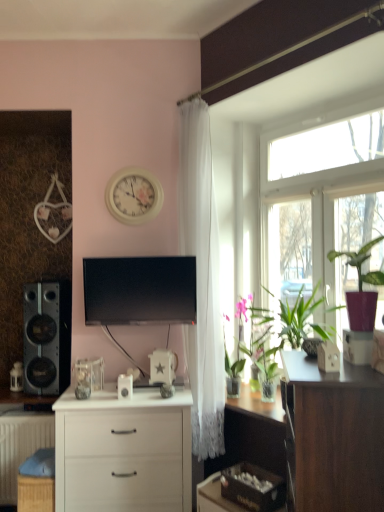
Measure the distance between white sheer curtain at upper center and camera.

white sheer curtain at upper center is 8.81 feet away from camera.

Describe the element at coordinates (47, 337) in the screenshot. This screenshot has height=512, width=384. I see `matte black speaker at left` at that location.

Find the location of `transparent glass window at upper right`. transparent glass window at upper right is located at coordinates (322, 206).

What are the coordinates of `brown wooden desk at lower center` in the screenshot? It's located at (214, 497).

Locate an element on the screen. Image resolution: width=384 pixels, height=512 pixels. white sheer curtain at upper center is located at coordinates (202, 280).

The width and height of the screenshot is (384, 512). I want to click on chest of drawers lying on the left of white sheer curtain at upper center, so click(123, 452).

Considering the sizes of objects white matte chest of drawers at center and white sheer curtain at upper center in the image provided, who is smaller, white matte chest of drawers at center or white sheer curtain at upper center?

white sheer curtain at upper center.

From a real-world perspective, which is physically above, white matte chest of drawers at center or white sheer curtain at upper center?

white sheer curtain at upper center is physically above.

Which is correct: white matte chest of drawers at center is inside white sheer curtain at upper center, or outside of it?

white matte chest of drawers at center lies outside white sheer curtain at upper center.

Is transparent glass window at upper right wider or thinner than brown wooden desk at lower center?

In the image, transparent glass window at upper right appears to be more narrow than brown wooden desk at lower center.

Would you say brown wooden desk at lower center is part of transparent glass window at upper right's contents?

No, brown wooden desk at lower center is not surrounded by transparent glass window at upper right.

From the image's perspective, which is above, transparent glass window at upper right or brown wooden desk at lower center?

transparent glass window at upper right, from the image's perspective.

Is point (117, 323) behind point (31, 488)?

Yes, it is.

Between black glossy tv at center and woven brown picnic basket at lower left, which one has larger size?

With larger size is black glossy tv at center.

Is black glossy tv at center aimed at woven brown picnic basket at lower left?

No, black glossy tv at center is not oriented towards woven brown picnic basket at lower left.

Does transparent glass window at upper right have a lesser width compared to matte black speaker at left?

Yes, transparent glass window at upper right is thinner than matte black speaker at left.

From their relative heights in the image, would you say transparent glass window at upper right is taller or shorter than matte black speaker at left?

In the image, transparent glass window at upper right appears to be taller than matte black speaker at left.

In terms of size, does transparent glass window at upper right appear bigger or smaller than matte black speaker at left?

Considering their sizes, transparent glass window at upper right takes up more space than matte black speaker at left.

Is matte black speaker at left a part of transparent glass window at upper right?

That's incorrect, matte black speaker at left is not inside transparent glass window at upper right.

Is white sheer curtain at upper center positioned far away from woven brown picnic basket at lower left?

That's right, there is a large distance between white sheer curtain at upper center and woven brown picnic basket at lower left.

Could you tell me if white sheer curtain at upper center is facing woven brown picnic basket at lower left?

No, white sheer curtain at upper center is not turned towards woven brown picnic basket at lower left.

Is woven brown picnic basket at lower left a part of white sheer curtain at upper center?

No.

Who is more distant, matte black speaker at left or dark wood cabinet at right?

matte black speaker at left is behind.

Which is more to the right, matte black speaker at left or dark wood cabinet at right?

From the viewer's perspective, dark wood cabinet at right appears more on the right side.

How far apart are matte black speaker at left and dark wood cabinet at right?

A distance of 6.20 feet exists between matte black speaker at left and dark wood cabinet at right.

From a real-world perspective, is matte black speaker at left over dark wood cabinet at right?

Yes, from a real-world perspective, matte black speaker at left is over dark wood cabinet at right

From a real-world perspective, between dark wood cabinet at right and matte black speaker at left, who is vertically higher?

matte black speaker at left is physically above.

Is dark wood cabinet at right situated inside matte black speaker at left or outside?

dark wood cabinet at right exists outside the volume of matte black speaker at left.

Considering the relative sizes of dark wood cabinet at right and matte black speaker at left in the image provided, is dark wood cabinet at right wider than matte black speaker at left?

Yes, dark wood cabinet at right is wider than matte black speaker at left.

Locate an element on the screen. The image size is (384, 512). curtain located above the white matte chest of drawers at center (from a real-world perspective) is located at coordinates (202, 280).

This screenshot has height=512, width=384. I want to click on window on the right of brown wooden desk at lower center, so click(x=322, y=206).

Consider the image. When comparing their distances from white sheer curtain at upper center, does brown wooden desk at lower center or woven brown picnic basket at lower left seem further?

woven brown picnic basket at lower left.

Considering their positions, is translucent glass vase at right, which ranks as the first plant in back-to-front order, positioned closer to brown wooden desk at lower center than woven brown picnic basket at lower left?

Based on the image, translucent glass vase at right, which ranks as the first plant in back-to-front order, appears to be nearer to brown wooden desk at lower center.

Considering their positions, is dark wood cabinet at right positioned closer to matte purple pot at right than white matte radiator at lower left?

Among the two, dark wood cabinet at right is located nearer to matte purple pot at right.

From the image, which object appears to be nearer to white sheer curtain at upper center, white matte radiator at lower left or white matte chest of drawers at center?

white matte chest of drawers at center lies closer to white sheer curtain at upper center than the other object.

Based on their spatial positions, is matte black speaker at left or white glossy clock at upper center closer to white matte radiator at lower left?

The object closer to white matte radiator at lower left is matte black speaker at left.

Based on their spatial positions, is white sheer curtain at upper center or white matte radiator at lower left closer to white glossy clock at upper center?

Based on the image, white sheer curtain at upper center appears to be nearer to white glossy clock at upper center.

Considering their positions, is white sheer curtain at upper center positioned further to white matte chest of drawers at center than white glossy clock at upper center?

white glossy clock at upper center lies further to white matte chest of drawers at center than the other object.

Based on their spatial positions, is dark wood cabinet at right or black glossy tv at center further from white matte chest of drawers at center?

dark wood cabinet at right.

The height and width of the screenshot is (512, 384). In order to click on cabinetry between matte purple pot at right and brown wooden desk at lower center from top to bottom in this screenshot , I will do `click(334, 436)`.

This screenshot has height=512, width=384. What are the coordinates of `chest of drawers between white matte radiator at lower left and transparent glass window at upper right` in the screenshot? It's located at (123, 452).

Identify the location of desk between white glossy clock at upper center and white matte radiator at lower left vertically. (214, 497).

Identify the location of cabinetry between white glossy clock at upper center and white matte chest of drawers at center from top to bottom. (334, 436).